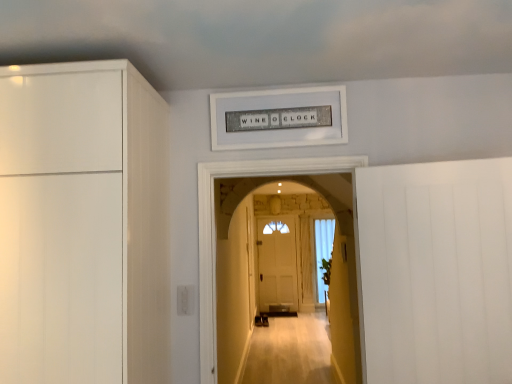
Question: Is smooth beige carpet at center turned away from white sheer curtain at center?

Choices:
 (A) no
 (B) yes

Answer: (B)

Question: Can you confirm if smooth beige carpet at center is bigger than white sheer curtain at center?

Choices:
 (A) yes
 (B) no

Answer: (A)

Question: Is smooth beige carpet at center closer to the viewer compared to white sheer curtain at center?

Choices:
 (A) yes
 (B) no

Answer: (A)

Question: Is smooth beige carpet at center touching white sheer curtain at center?

Choices:
 (A) no
 (B) yes

Answer: (A)

Question: Does smooth beige carpet at center appear on the right side of white sheer curtain at center?

Choices:
 (A) no
 (B) yes

Answer: (A)

Question: In terms of size, does white sheer curtain at center appear bigger or smaller than white matte door at right?

Choices:
 (A) big
 (B) small

Answer: (A)

Question: Considering the positions of point (317, 294) and point (468, 261), is point (317, 294) closer or farther from the camera than point (468, 261)?

Choices:
 (A) farther
 (B) closer

Answer: (A)

Question: Considering the relative positions of white sheer curtain at center and white matte door at right in the image provided, is white sheer curtain at center to the left or to the right of white matte door at right?

Choices:
 (A) left
 (B) right

Answer: (B)

Question: From the image's perspective, is white sheer curtain at center positioned above or below white matte door at right?

Choices:
 (A) above
 (B) below

Answer: (B)

Question: Relative to white textured sign at upper center, is white sheer curtain at center in front or behind?

Choices:
 (A) front
 (B) behind

Answer: (B)

Question: Would you say white sheer curtain at center is inside or outside white textured sign at upper center?

Choices:
 (A) inside
 (B) outside

Answer: (B)

Question: Would you say white sheer curtain at center is to the left or to the right of white textured sign at upper center in the picture?

Choices:
 (A) right
 (B) left

Answer: (A)

Question: Considering the positions of white sheer curtain at center and white textured sign at upper center in the image, is white sheer curtain at center wider or thinner than white textured sign at upper center?

Choices:
 (A) wide
 (B) thin

Answer: (A)

Question: Considering the relative positions of smooth beige carpet at center and white textured sign at upper center in the image provided, is smooth beige carpet at center to the left or to the right of white textured sign at upper center?

Choices:
 (A) right
 (B) left

Answer: (A)

Question: Looking at the image, does smooth beige carpet at center seem bigger or smaller compared to white textured sign at upper center?

Choices:
 (A) small
 (B) big

Answer: (B)